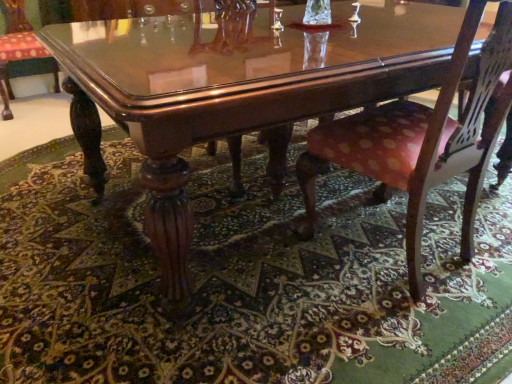
Question: In terms of width, does green patterned rug at lower center look wider or thinner when compared to polished wood chair at lower left, placed as the second chair when sorted from right to left?

Choices:
 (A) wide
 (B) thin

Answer: (A)

Question: From the image's perspective, is green patterned rug at lower center positioned above or below polished wood chair at lower left, placed as the second chair when sorted from right to left?

Choices:
 (A) above
 (B) below

Answer: (B)

Question: Considering the real-world distances, which object is farthest from the glossy wood coffee table at center?

Choices:
 (A) green patterned rug at lower center
 (B) polka dot fabric chair at lower right, marked as the 1th chair in a bottom-to-top arrangement
 (C) polished wood chair at lower left, placed as the 1th chair when sorted from top to bottom

Answer: (C)

Question: Considering the real-world distances, which object is farthest from the polka dot fabric chair at lower right, the first chair positioned from the right?

Choices:
 (A) green patterned rug at lower center
 (B) polished wood chair at lower left, placed as the 1th chair when sorted from top to bottom
 (C) glossy wood coffee table at center

Answer: (B)